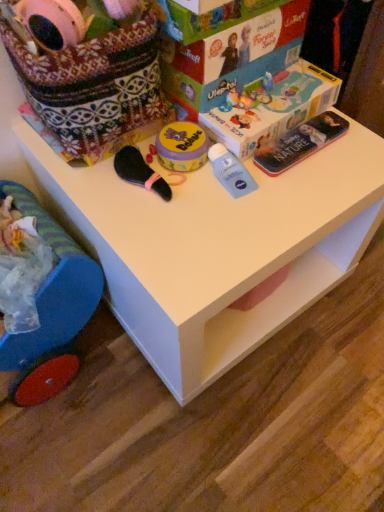
Locate an element on the screen. This screenshot has height=512, width=384. vacant area on top of white plastic table at center (from a real-world perspective) is located at coordinates (218, 185).